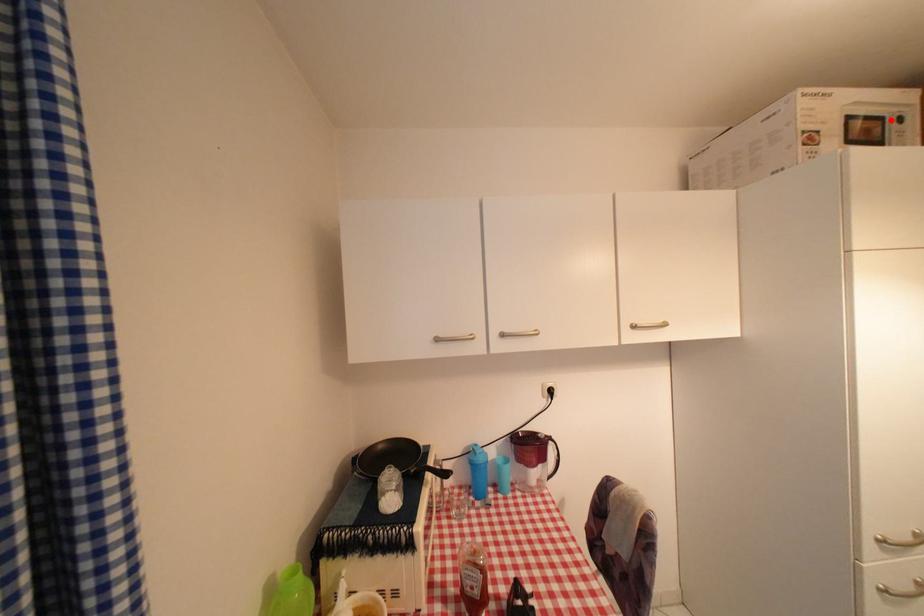
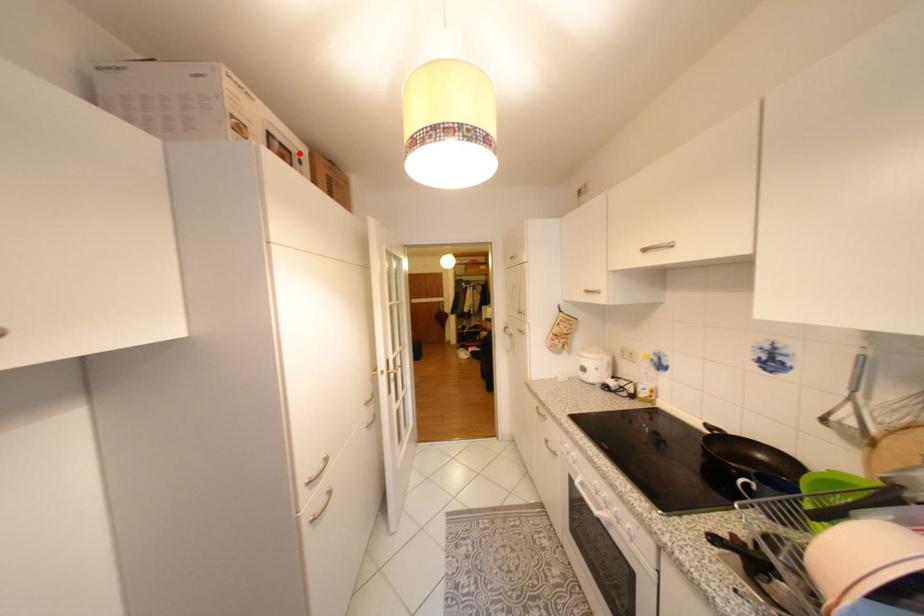
I am providing you with two images of the same scene from different viewpoints. A red point is marked on the first image and another point is marked on the second image. Does the point marked in image1 correspond to the same location as the one in image2?

Yes